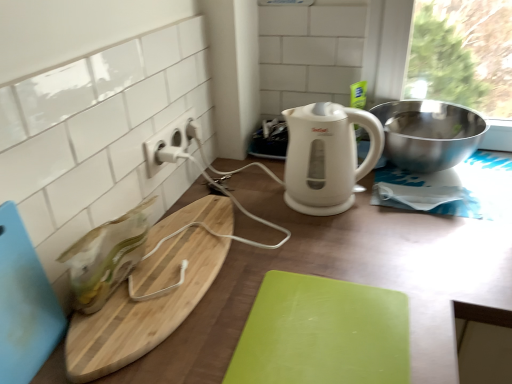
I want to click on vacant space situated on the left part of white glossy electric kettle at center, so click(x=261, y=191).